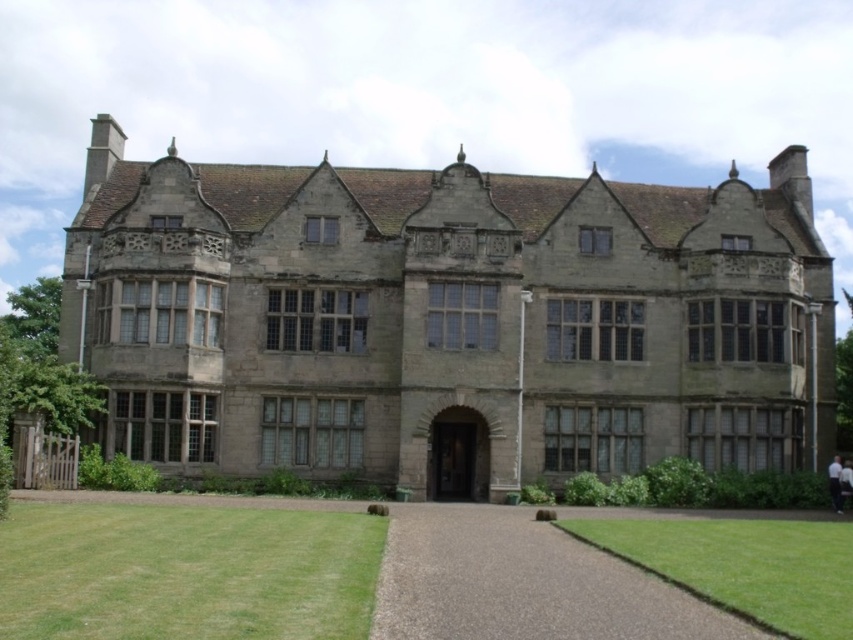
Question: Is green grass at lower left behind brown gravel driveway at center?

Choices:
 (A) yes
 (B) no

Answer: (B)

Question: Estimate the real-world distances between objects in this image. Which object is farther from the gray stone mansion at center?

Choices:
 (A) green grass at lower left
 (B) green grass at lower right

Answer: (A)

Question: Which object appears closest to the camera in this image?

Choices:
 (A) gray stone mansion at center
 (B) green grass at lower right

Answer: (B)

Question: Among these points, which one is nearest to the camera?

Choices:
 (A) (744, 426)
 (B) (297, 582)
 (C) (788, 625)

Answer: (C)

Question: From the image, what is the correct spatial relationship of gray stone mansion at center in relation to brown gravel driveway at center?

Choices:
 (A) above
 (B) below

Answer: (A)

Question: Does green grass at lower left have a greater width compared to brown gravel driveway at center?

Choices:
 (A) yes
 (B) no

Answer: (A)